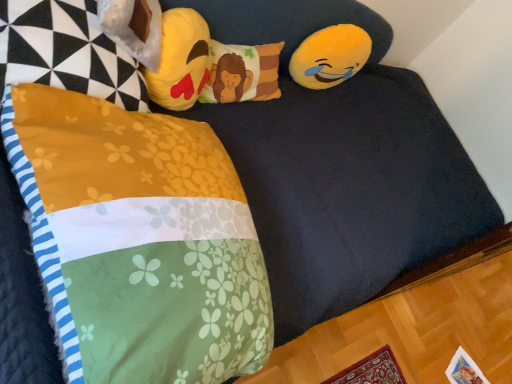
Identify the location of blank space situated above floral fabric pillow at center, arranged as the first pillow when viewed from the back (from a real-world perspective). This screenshot has height=384, width=512. (245, 55).